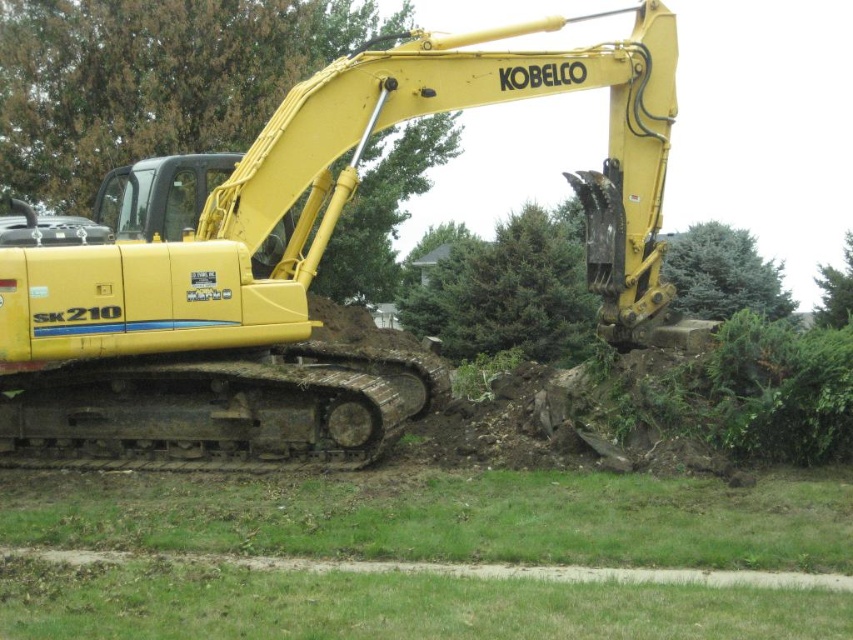
Question: Which of the following is the closest to the observer?

Choices:
 (A) (762, 310)
 (B) (128, 72)
 (C) (839, 291)

Answer: (B)

Question: Does green leafy tree at upper center have a greater width compared to green textured tree at upper center?

Choices:
 (A) yes
 (B) no

Answer: (A)

Question: Among these objects, which one is nearest to the camera?

Choices:
 (A) yellow rubber tractor at center
 (B) green leafy tree at upper right
 (C) green leafy tree at upper center

Answer: (A)

Question: Does yellow rubber tractor at center have a smaller size compared to green leafy tree at upper center?

Choices:
 (A) no
 (B) yes

Answer: (A)

Question: Estimate the real-world distances between objects in this image. Which object is farther from the green leafy tree at upper center?

Choices:
 (A) green textured tree at upper center
 (B) green leafy tree at upper right
 (C) yellow rubber tractor at center

Answer: (B)

Question: Does yellow rubber tractor at center come in front of green textured tree at upper center?

Choices:
 (A) yes
 (B) no

Answer: (A)